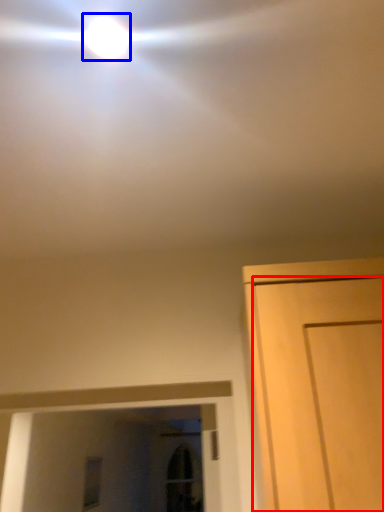
Question: Which object is closer to the camera taking this photo, door (highlighted by a red box) or droplight (highlighted by a blue box)?

Choices:
 (A) door
 (B) droplight

Answer: (A)